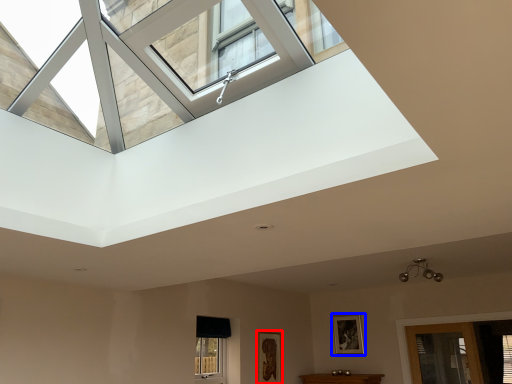
Question: Which of the following is the farthest to the observer, picture frame (highlighted by a red box) or picture frame (highlighted by a blue box)?

Choices:
 (A) picture frame
 (B) picture frame

Answer: (B)